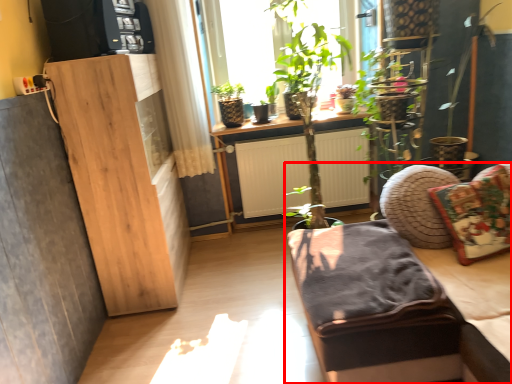
Question: From the image's perspective, considering the relative positions of studio couch (annotated by the red box) and pillow in the image provided, where is studio couch (annotated by the red box) located with respect to the staircase?

Choices:
 (A) below
 (B) above

Answer: (A)